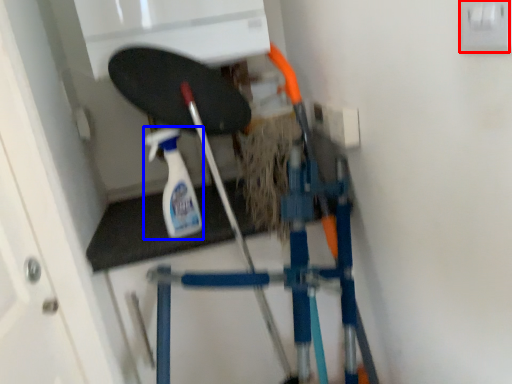
Question: Which of the following is the farthest to the observer, electric outlet (highlighted by a red box) or cleaning product (highlighted by a blue box)?

Choices:
 (A) electric outlet
 (B) cleaning product

Answer: (B)